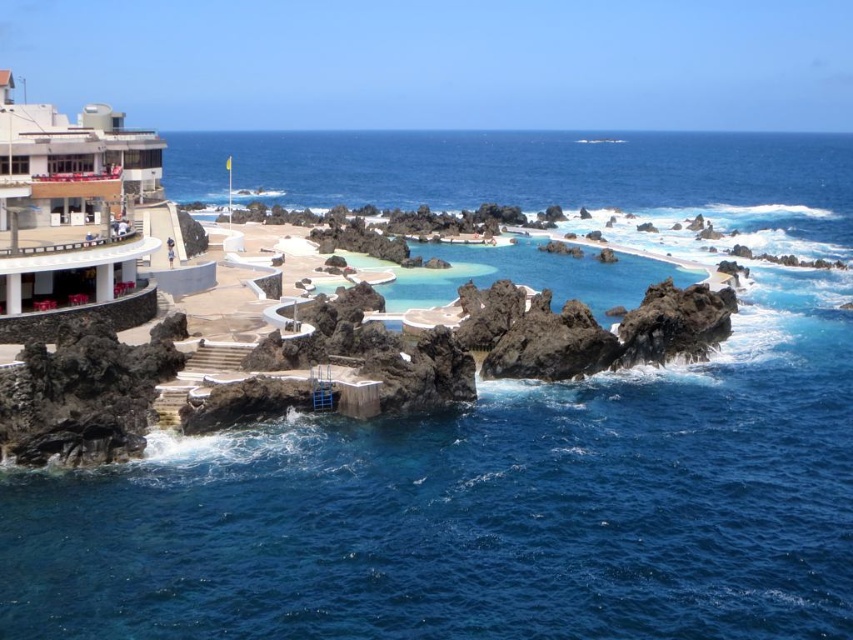
Consider the image. You are planning to build a new structure near the white concrete building at upper left and the clear glass pool at center. Considering their sizes, which one would require more space for expansion?

The clear glass pool at center requires more space for expansion since it is larger than the white concrete building at upper left.

You are standing at the point with coordinates point (622,278) and want to move to the point with coordinates point (103,118). Based on the scene description, which direction should you move in to reach your destination?

You should move forward because point (103,118) is in front of point (622,278) according to the spatial relationship provided.